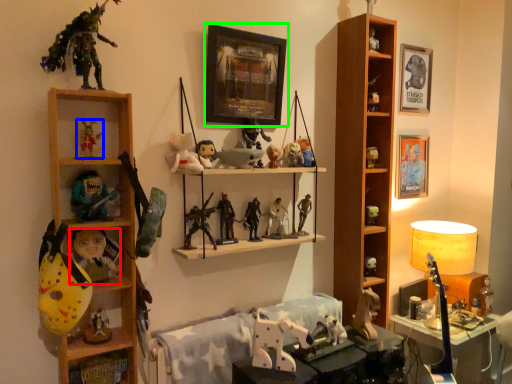
Question: Considering the real-world distances, which object is closest to toy (highlighted by a red box)? toy (highlighted by a blue box) or picture frame (highlighted by a green box).

Choices:
 (A) toy
 (B) picture frame

Answer: (A)